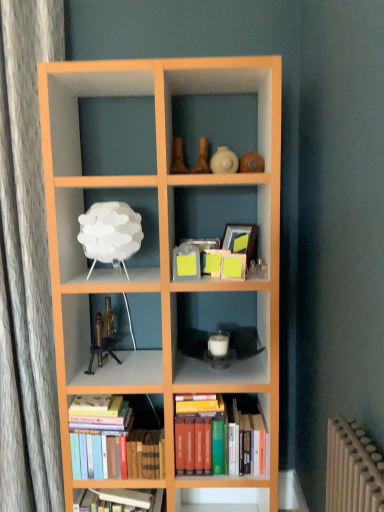
Question: Does white matte lamp at upper left, acting as the 1th shelf starting from the left, have a greater width compared to white matte candle at center, marked as the first shelf in a bottom-to-top arrangement?

Choices:
 (A) no
 (B) yes

Answer: (A)

Question: Is the position of white matte lamp at upper left, the second shelf from the bottom, more distant than that of white matte candle at center, the second shelf in the top-to-bottom sequence?

Choices:
 (A) yes
 (B) no

Answer: (B)

Question: From a real-world perspective, is white matte lamp at upper left, the second shelf from the bottom, physically below white matte candle at center, which is the first shelf from right to left?

Choices:
 (A) no
 (B) yes

Answer: (A)

Question: Can we say white matte lamp at upper left, arranged as the 1th shelf when viewed from the top, lies outside white matte candle at center, the 2th shelf viewed from the left?

Choices:
 (A) no
 (B) yes

Answer: (B)

Question: Does white matte lamp at upper left, the second shelf from the bottom, have a smaller size compared to white matte candle at center, the 2th shelf viewed from the left?

Choices:
 (A) yes
 (B) no

Answer: (B)

Question: Is white matte lamp at upper left, acting as the 1th shelf starting from the left, at the right side of white matte candle at center, the 2th shelf viewed from the left?

Choices:
 (A) no
 (B) yes

Answer: (A)

Question: Is white matte lamp at upper left, acting as the 1th shelf starting from the left, at the left side of hardcover books at bottom left, the first book positioned from the left?

Choices:
 (A) yes
 (B) no

Answer: (A)

Question: From a real-world perspective, is white matte lamp at upper left, the 2th shelf positioned from the right, located beneath hardcover books at bottom left, acting as the 2th book starting from the right?

Choices:
 (A) yes
 (B) no

Answer: (B)

Question: From the image's perspective, is white matte lamp at upper left, the second shelf from the bottom, located beneath hardcover books at bottom left, the first book positioned from the left?

Choices:
 (A) no
 (B) yes

Answer: (A)

Question: Considering the relative sizes of white matte lamp at upper left, acting as the 1th shelf starting from the left, and hardcover books at bottom left, acting as the 2th book starting from the right, in the image provided, is white matte lamp at upper left, acting as the 1th shelf starting from the left, smaller than hardcover books at bottom left, acting as the 2th book starting from the right,?

Choices:
 (A) no
 (B) yes

Answer: (B)

Question: Could you tell me if white matte lamp at upper left, the 2th shelf positioned from the right, is facing hardcover books at bottom left, acting as the 2th book starting from the right?

Choices:
 (A) no
 (B) yes

Answer: (A)

Question: Is white matte lamp at upper left, acting as the 1th shelf starting from the left, not inside hardcover books at bottom left, the first book positioned from the left?

Choices:
 (A) no
 (B) yes

Answer: (B)

Question: Does brass metallic microscope at center-left have a greater height compared to hardcover books at center, arranged as the 1th book when viewed from the right?

Choices:
 (A) yes
 (B) no

Answer: (B)